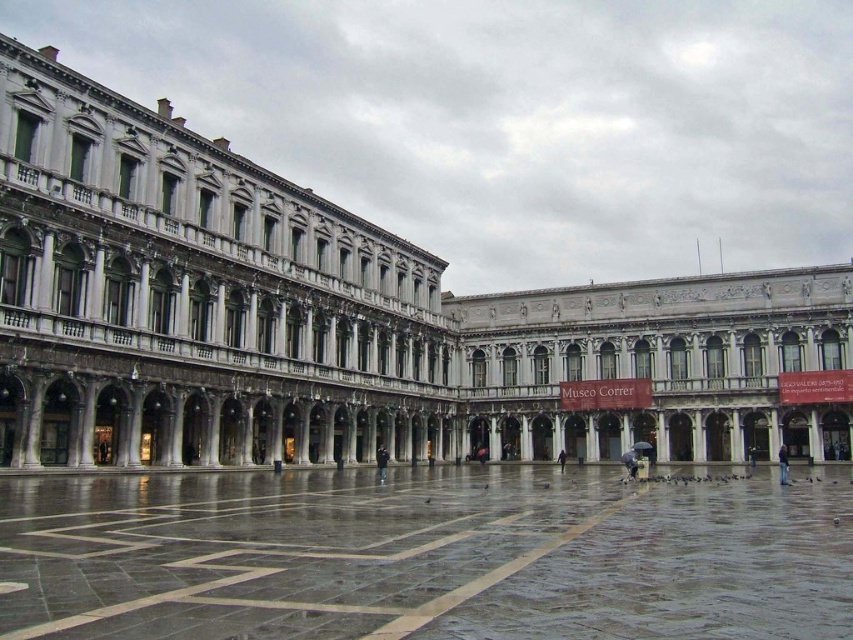
Is white marble palace at center taller than dark blue jacket at center?

Correct, white marble palace at center is much taller as dark blue jacket at center.

From the picture: Which of these two, white marble palace at center or dark blue jacket at center, stands shorter?

dark blue jacket at center

Is point (407, 310) in front of point (381, 445)?

No, (407, 310) is further to viewer.

Identify the location of white marble palace at center. (349, 321).

Who is more forward, (x=254, y=515) or (x=563, y=460)?

Point (x=254, y=515) is more forward.

Does marble floor at center have a smaller size compared to dark blue fabric at center?

Actually, marble floor at center might be larger than dark blue fabric at center.

Between point (570, 481) and point (560, 451), which one is positioned in front?

Point (570, 481) is more forward.

At what (x,y) coordinates should I click in order to perform the action: click on marble floor at center. Please return your answer as a coordinate pair (x, y). The width and height of the screenshot is (853, 640). Looking at the image, I should click on (425, 556).

Between point (601, 305) and point (785, 480), which one is positioned in front?

Point (785, 480)

Identify the location of white marble palace at center. The image size is (853, 640). (349, 321).

The height and width of the screenshot is (640, 853). In order to click on white marble palace at center in this screenshot , I will do `click(349, 321)`.